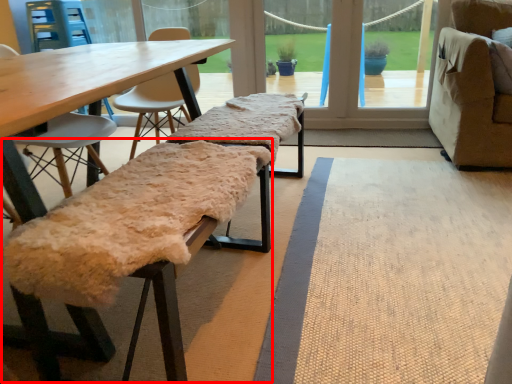
Question: Observing the image, what is the correct spatial positioning of park bench (annotated by the red box) in reference to park bench?

Choices:
 (A) left
 (B) right

Answer: (A)